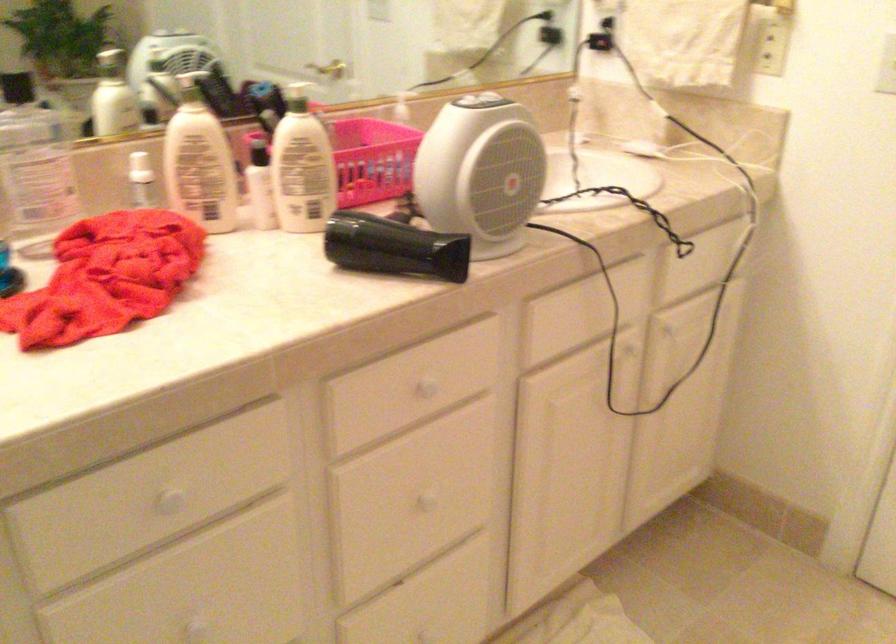
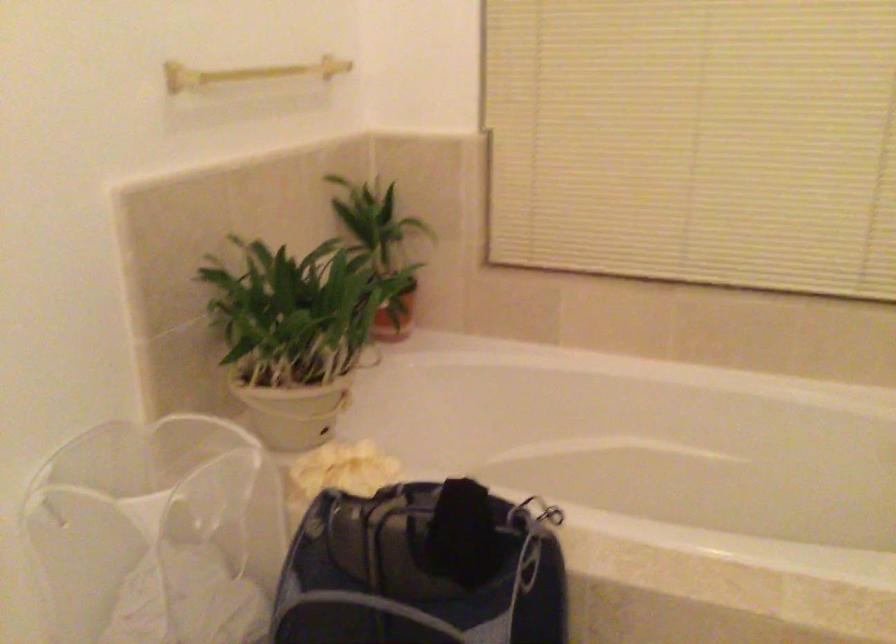
First-person continuous shooting, in which direction is the camera rotating?

The camera's rotation is toward right-down.